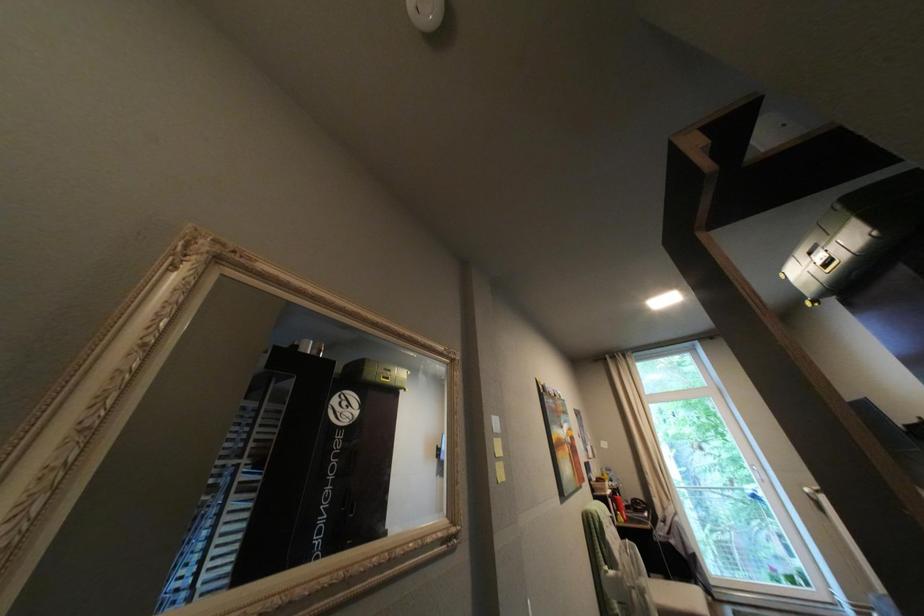
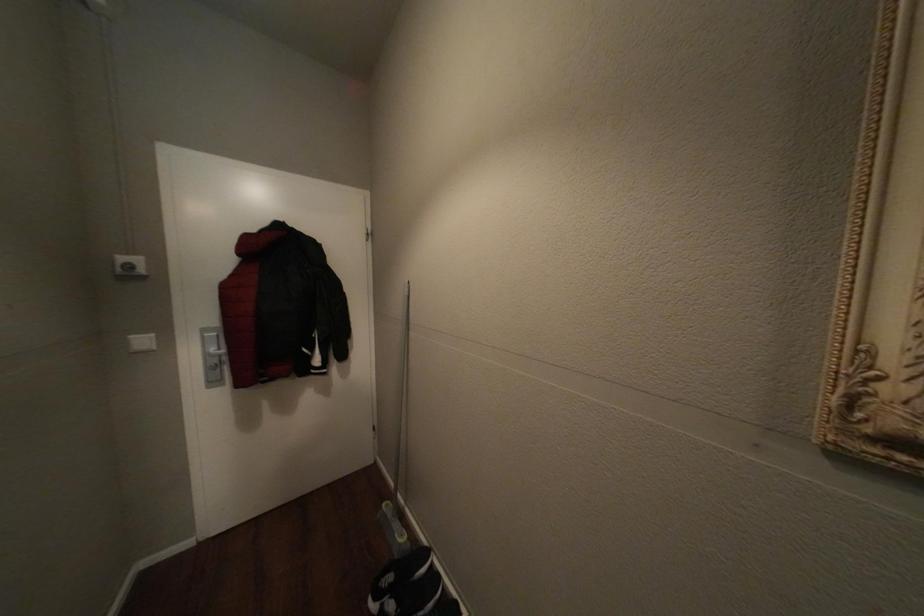
Question: How did the camera likely rotate?

Choices:
 (A) Left
 (B) Right
 (C) Up
 (D) Down

Answer: (A)